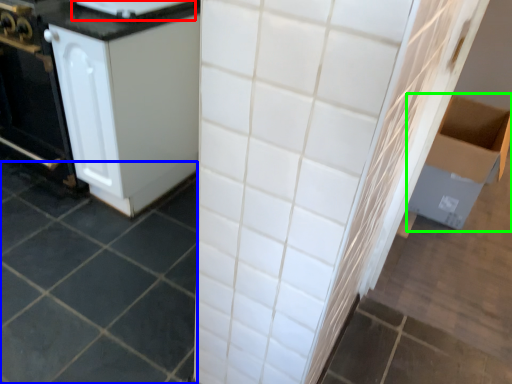
Question: Which is nearer to the appliance (highlighted by a red box)? ceramic tile (highlighted by a blue box) or cardboard box (highlighted by a green box).

Choices:
 (A) ceramic tile
 (B) cardboard box

Answer: (A)